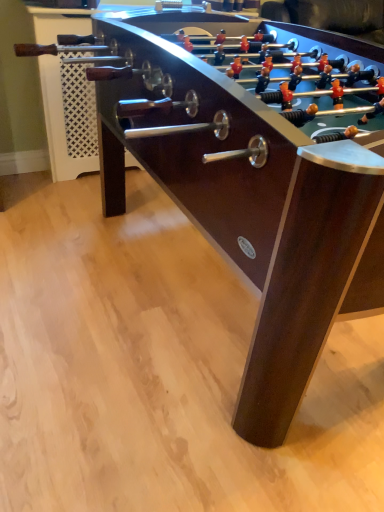
You are a GUI agent. You are given a task and a screenshot of the screen. Output one action in this format:
    pyautogui.click(x=<x>, y=<y>)
    Task: Click on the free spot below dark wood foosball table at center (from a real-world perspective)
    This screenshot has height=512, width=384.
    Given the screenshot: What is the action you would take?
    pyautogui.click(x=173, y=292)